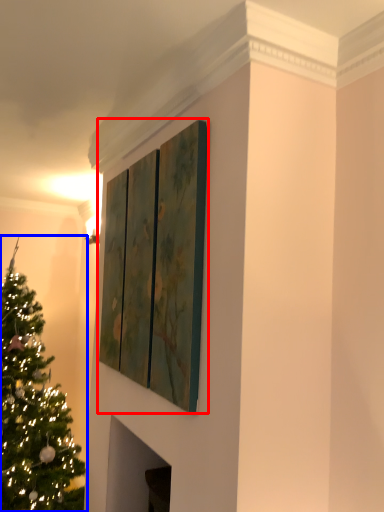
Question: Which object appears closest to the camera in this image, window (highlighted by a red box) or christmas tree (highlighted by a blue box)?

Choices:
 (A) window
 (B) christmas tree

Answer: (A)